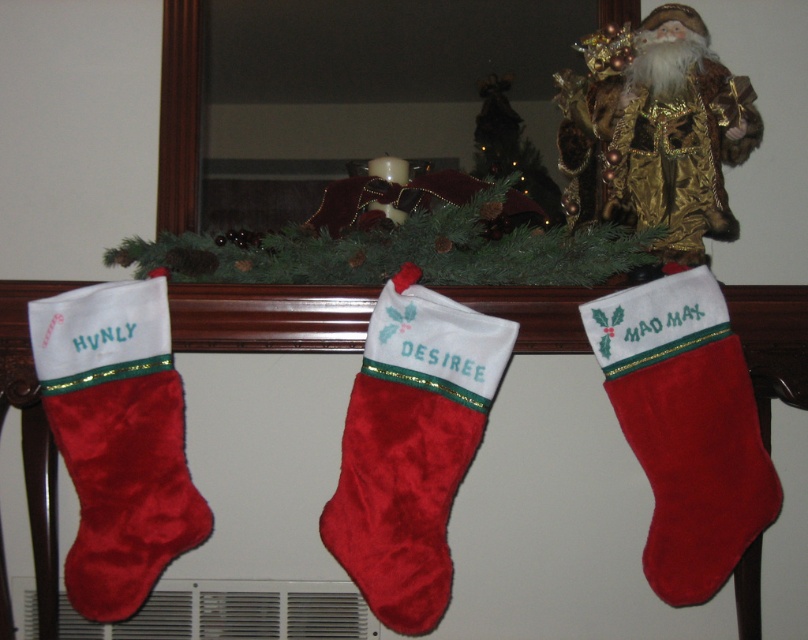
Who is shorter, velvet red stocking at center or velvet red stocking at right?

With less height is velvet red stocking at right.

Is velvet red stocking at center to the left of velvet red stocking at right from the viewer's perspective?

Yes, velvet red stocking at center is to the left of velvet red stocking at right.

Identify the location of velvet red stocking at center. (411, 445).

Find the location of `velvet red stocking at center`. velvet red stocking at center is located at coordinates (411, 445).

From the picture: Does velvet red stocking at center have a larger size compared to velvet red stocking at left?

Yes, velvet red stocking at center is bigger than velvet red stocking at left.

Between velvet red stocking at center and velvet red stocking at left, which one appears on the right side from the viewer's perspective?

velvet red stocking at center is more to the right.

Between point (407, 404) and point (121, 344), which one is positioned in front?

Point (121, 344) is in front.

Identify the location of velvet red stocking at center. (411, 445).

Which is more to the left, velvet red stocking at left or velvet red stocking at right?

Positioned to the left is velvet red stocking at left.

Does velvet red stocking at left have a larger size compared to velvet red stocking at right?

No.

Who is more distant from viewer, (149, 476) or (583, 317)?

Positioned behind is point (583, 317).

The image size is (808, 640). I want to click on velvet red stocking at left, so click(116, 438).